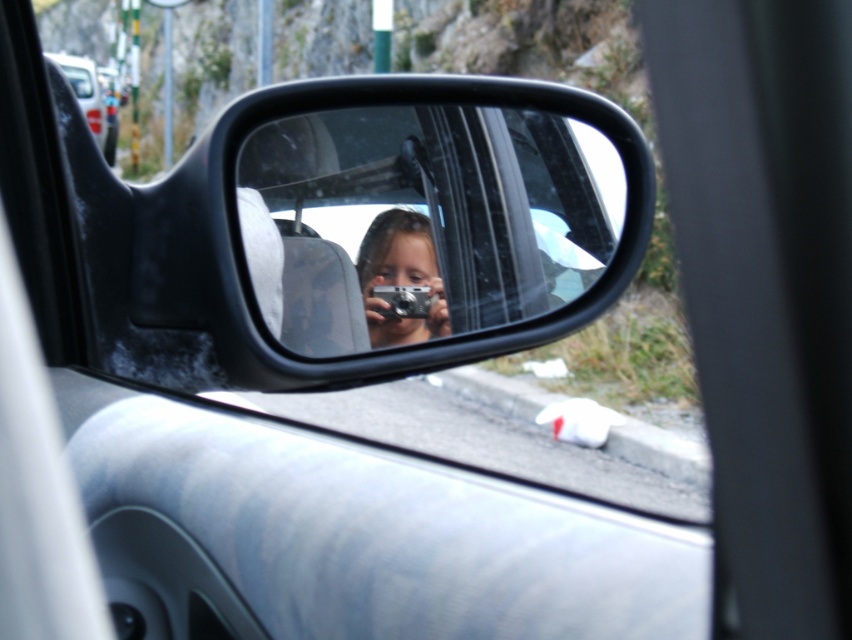
Does matte silver camera at center have a lesser width compared to metallic silver car at upper left?

Yes.

Where is `matte silver camera at center`? matte silver camera at center is located at coordinates (400, 276).

Where is `matte silver camera at center`? The width and height of the screenshot is (852, 640). matte silver camera at center is located at coordinates (400, 276).

Which is in front, point (401, 221) or point (412, 264)?

Point (401, 221) is more forward.

Measure the distance from clear plastic mirror at center to matte silver camera at center.

12.29 centimeters

Measure the distance between clear plastic mirror at center and camera.

clear plastic mirror at center is 6.27 feet away from camera.

Image resolution: width=852 pixels, height=640 pixels. In order to click on clear plastic mirror at center in this screenshot , I will do `click(423, 220)`.

Which is below, clear plastic mirror at center or metallic silver car at upper left?

clear plastic mirror at center is lower down.

Which of these two, clear plastic mirror at center or metallic silver car at upper left, stands shorter?

With less height is clear plastic mirror at center.

Does point (557, 264) come closer to viewer compared to point (87, 90)?

Yes.

You are a GUI agent. You are given a task and a screenshot of the screen. Output one action in this format:
    pyautogui.click(x=<x>, y=<y>)
    Task: Click on the clear plastic mirror at center
    The image size is (852, 640).
    Given the screenshot: What is the action you would take?
    pyautogui.click(x=423, y=220)